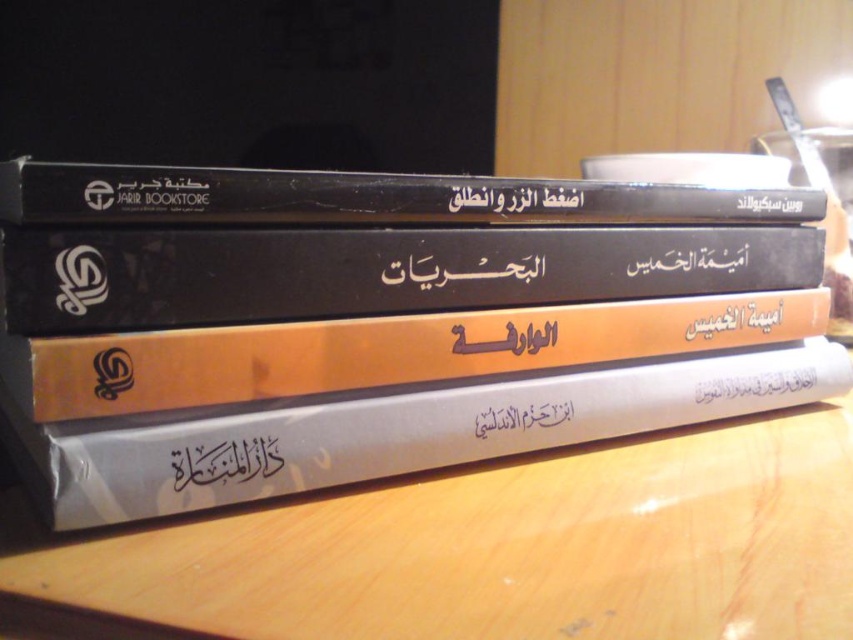
Question: Which object is farther from the camera taking this photo?

Choices:
 (A) black matte book at upper center
 (B) matte black book at center

Answer: (B)

Question: Which point is farther to the camera?

Choices:
 (A) (206, 637)
 (B) (502, 410)
 (C) (697, 209)

Answer: (C)

Question: Is black matte book at center to the left of gold paper book at center from the viewer's perspective?

Choices:
 (A) yes
 (B) no

Answer: (B)

Question: Can you confirm if matte black book at center is bigger than black matte book at center?

Choices:
 (A) no
 (B) yes

Answer: (B)

Question: Which point is closer to the camera taking this photo?

Choices:
 (A) (779, 200)
 (B) (279, 193)

Answer: (B)

Question: Is black matte book at center to the left of black calligraphy at center from the viewer's perspective?

Choices:
 (A) yes
 (B) no

Answer: (B)